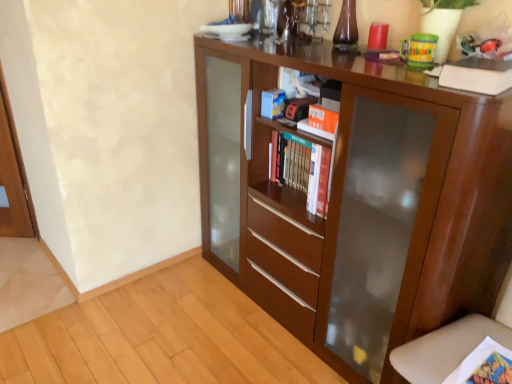
Find the location of a particular element. This screenshot has height=384, width=512. free region on the left part of white matte book at upper right is located at coordinates (411, 85).